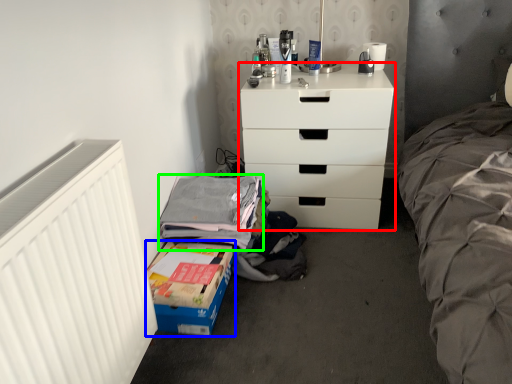
Question: Estimate the real-world distances between objects in this image. Which object is closer to chest of drawers (highlighted by a red box), box (highlighted by a blue box) or clothing (highlighted by a green box)?

Choices:
 (A) box
 (B) clothing

Answer: (B)